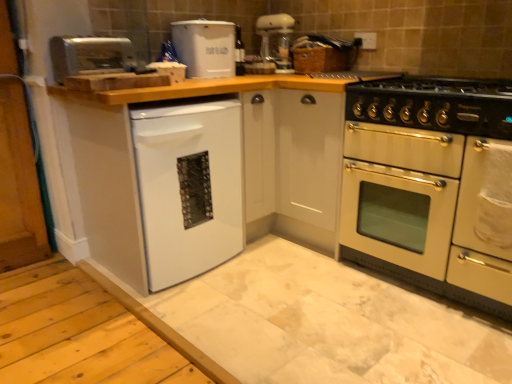
Question: From the image's perspective, is satin silver toaster at upper left, the first appliance in the left-to-right sequence, above white glossy dishwasher at lower left?

Choices:
 (A) yes
 (B) no

Answer: (A)

Question: Is satin silver toaster at upper left, the first appliance viewed from the front, surrounding white glossy dishwasher at lower left?

Choices:
 (A) no
 (B) yes

Answer: (A)

Question: From the image's perspective, is satin silver toaster at upper left, the first appliance in the left-to-right sequence, located beneath white glossy dishwasher at lower left?

Choices:
 (A) yes
 (B) no

Answer: (B)

Question: From a real-world perspective, is satin silver toaster at upper left, which ranks as the 2th appliance in back-to-front order, on top of white glossy dishwasher at lower left?

Choices:
 (A) yes
 (B) no

Answer: (A)

Question: Is satin silver toaster at upper left, which ranks as the 2th appliance in back-to-front order, bigger than white glossy dishwasher at lower left?

Choices:
 (A) yes
 (B) no

Answer: (B)

Question: In terms of height, does white plastic bread bin at upper center, which ranks as the first appliance in right-to-left order, look taller or shorter compared to satin silver toaster at upper left, which ranks as the 2th appliance in right-to-left order?

Choices:
 (A) tall
 (B) short

Answer: (A)

Question: From a real-world perspective, is white plastic bread bin at upper center, which ranks as the first appliance in right-to-left order, physically located above or below satin silver toaster at upper left, the first appliance in the left-to-right sequence?

Choices:
 (A) above
 (B) below

Answer: (A)

Question: From the image's perspective, relative to satin silver toaster at upper left, which ranks as the 2th appliance in right-to-left order, is white plastic bread bin at upper center, which appears as the second appliance when viewed from the front, above or below?

Choices:
 (A) below
 (B) above

Answer: (B)

Question: Do you think white plastic bread bin at upper center, the 2th appliance from the left, is within satin silver toaster at upper left, the first appliance in the left-to-right sequence, or outside of it?

Choices:
 (A) outside
 (B) inside

Answer: (A)

Question: In terms of size, does white glossy dishwasher at lower left appear bigger or smaller than cream matte oven at right?

Choices:
 (A) small
 (B) big

Answer: (A)

Question: From the image's perspective, is white glossy dishwasher at lower left located above or below cream matte oven at right?

Choices:
 (A) above
 (B) below

Answer: (A)

Question: In the image, is white glossy dishwasher at lower left on the left side or the right side of cream matte oven at right?

Choices:
 (A) left
 (B) right

Answer: (A)

Question: Considering their positions, is white glossy dishwasher at lower left located in front of or behind cream matte oven at right?

Choices:
 (A) behind
 (B) front

Answer: (A)

Question: Relative to white matte dishwasher at lower left, is black enamel gas stove at right in front or behind?

Choices:
 (A) front
 (B) behind

Answer: (B)

Question: Is point (374, 97) positioned closer to the camera than point (140, 96)?

Choices:
 (A) farther
 (B) closer

Answer: (A)